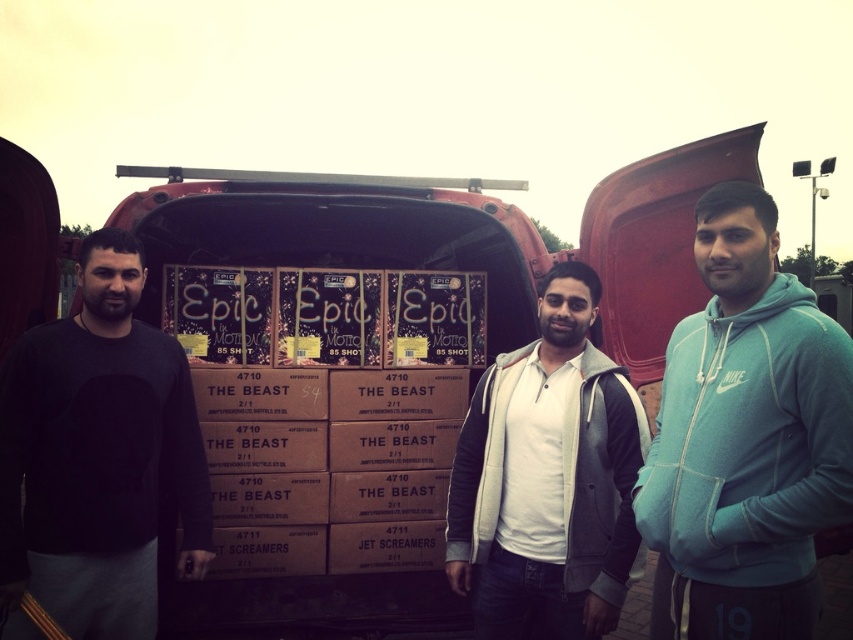
Is teal fleece hoodie at center to the left of black matte sweatshirt at left from the viewer's perspective?

In fact, teal fleece hoodie at center is to the right of black matte sweatshirt at left.

Which is more to the left, teal fleece hoodie at center or black matte sweatshirt at left?

black matte sweatshirt at left

Image resolution: width=853 pixels, height=640 pixels. Describe the element at coordinates (746, 440) in the screenshot. I see `teal fleece hoodie at center` at that location.

The width and height of the screenshot is (853, 640). In order to click on teal fleece hoodie at center in this screenshot , I will do `click(746, 440)`.

Which is in front, point (741, 570) or point (567, 392)?

Positioned in front is point (741, 570).

Which of these two, teal fleece hoodie at center or white fleece jacket at center, stands shorter?

Standing shorter between the two is white fleece jacket at center.

Locate an element on the screen. teal fleece hoodie at center is located at coordinates (746, 440).

Which is behind, point (62, 504) or point (538, 573)?

The point (538, 573) is behind.

Image resolution: width=853 pixels, height=640 pixels. Find the location of `black matte sweatshirt at left`. black matte sweatshirt at left is located at coordinates [x=97, y=458].

Identify the location of black matte sweatshirt at left. The image size is (853, 640). (97, 458).